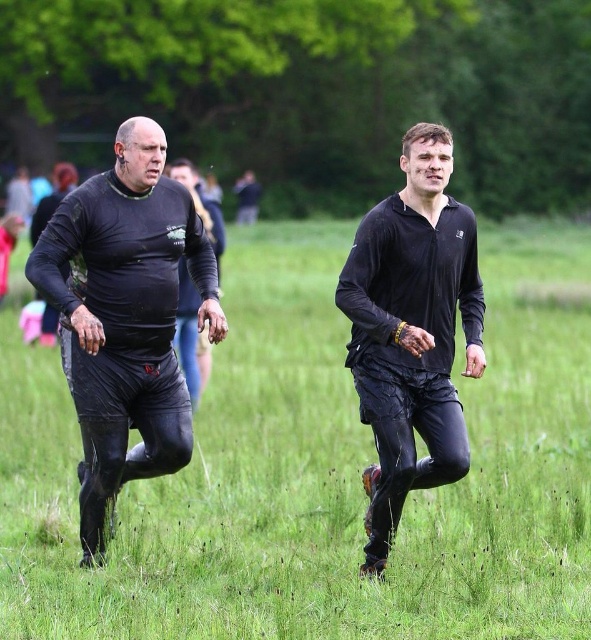
You are a photographer positioned at the origin of the coordinate system. You want to capture a closeup shot of the wet black pants at center. Given that your camera has a focal length of 50mm and the sensor size is 24mm x 36mm, what is the minimum distance in meters you need to be from the point at coordinate (317, 468) to ensure the entire wet black pants at center fits within the frame?

The point at coordinate (317, 468) corresponds to the wet black pants at center. To calculate the minimum distance, use the formula for field of view. The vertical FOV is 2 arctan, so the distance must be at least 1.2 meters to ensure the entire subject fits within the frame.

You are a photographer positioned at the edge of the field. You want to capture a photo of the wet black pants at center and the black matte jacket at center. If your camera has a maximum focus range of 15 feet, will you be able to focus on both objects simultaneously?

The wet black pants at center is 18.44 feet from the black matte jacket at center. Since the distance between them exceeds the camera maximum focus range of 15 feet, you cannot focus on both objects simultaneously.

You are a photographer positioned at the back of the field. You want to take a photo of the black matte clothing at left and the wet black pants at center. Which one will be closer to the camera in the photo?

The wet black pants at center is in front of the black matte clothing at left, so in the photo taken from the back of the field, the wet black pants at center will appear closer to the camera.